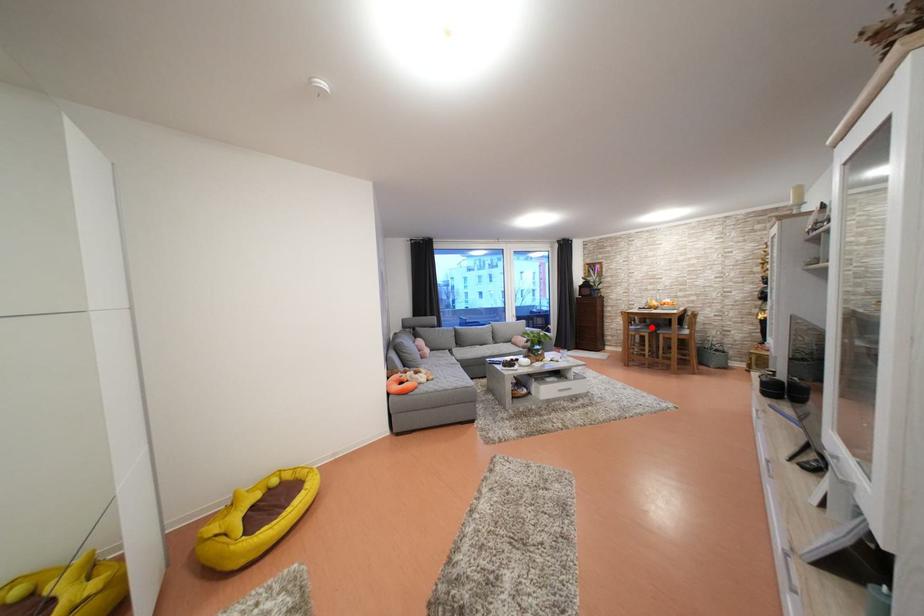
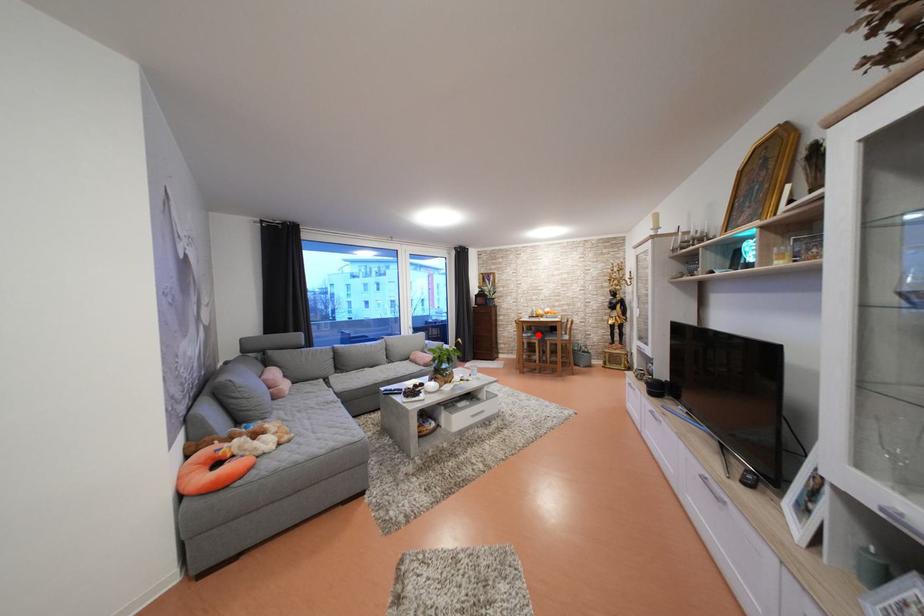
I am providing you with two images of the same scene from different viewpoints. A red point is marked on the first image and another point is marked on the second image. Is the red point in image1 aligned with the point shown in image2?

Yes